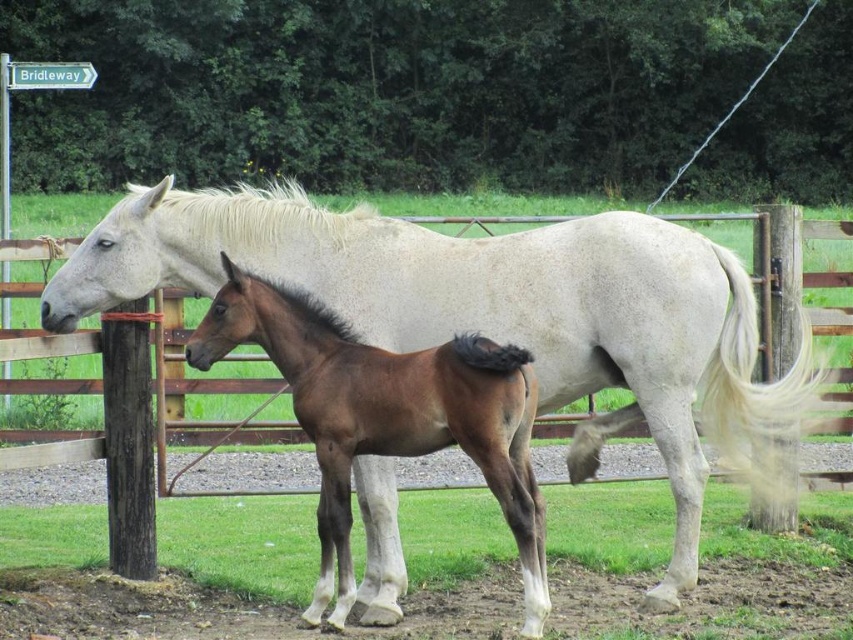
Question: Can you confirm if white matte horse at center is bigger than brown glossy horse at center?

Choices:
 (A) yes
 (B) no

Answer: (B)

Question: From the image, what is the correct spatial relationship of white matte horse at center in relation to brown glossy horse at center?

Choices:
 (A) left
 (B) right

Answer: (B)

Question: Which object is closer to the camera taking this photo?

Choices:
 (A) brown glossy horse at center
 (B) white matte horse at center

Answer: (A)

Question: Observing the image, what is the correct spatial positioning of white matte horse at center in reference to brown glossy horse at center?

Choices:
 (A) above
 (B) below

Answer: (A)